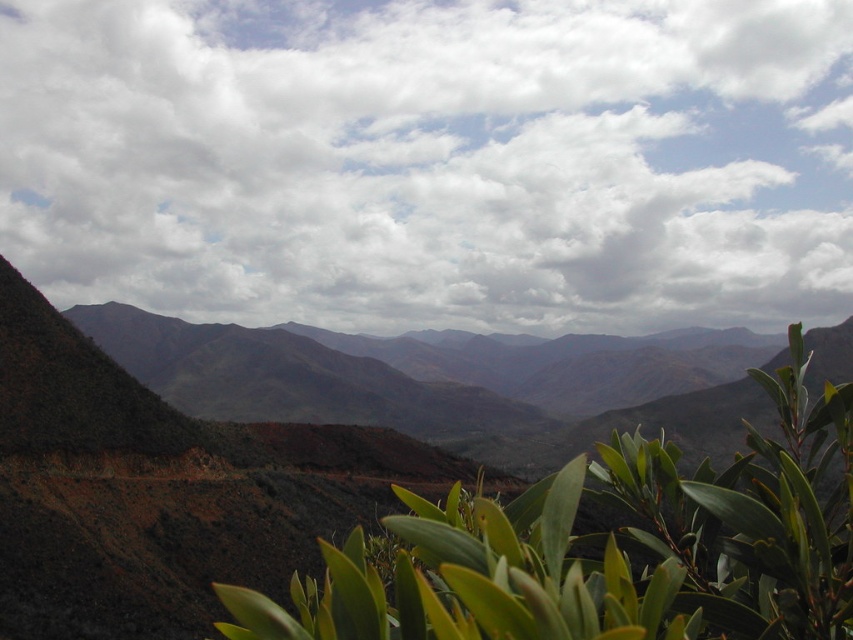
From the picture: You are a drone operator trying to capture a photo of the point at coordinates [498,147] in the mountainous landscape. The drone has a maximum flight distance of 300 meters. Can the drone safely reach the point without exceeding its range?

The point at coordinates [498,147] is 355.22 meters from the camera, which exceeds the drone operator drone maximum flight distance of 300 meters. Therefore, the drone cannot safely reach the point without exceeding its range.

From the picture: You are a hiker standing in the mountain landscape. You notice the white fluffy cloud at upper center and the green leafy plant at center. Which object appears taller in the scene?

The white fluffy cloud at upper center is taller than the green leafy plant at center.

You are an observer looking at the mountain landscape. You see a white fluffy cloud at upper center and a green leafy plant at center. Which object is positioned more to the left?

The white fluffy cloud at upper center is positioned more to the left than the green leafy plant at center.